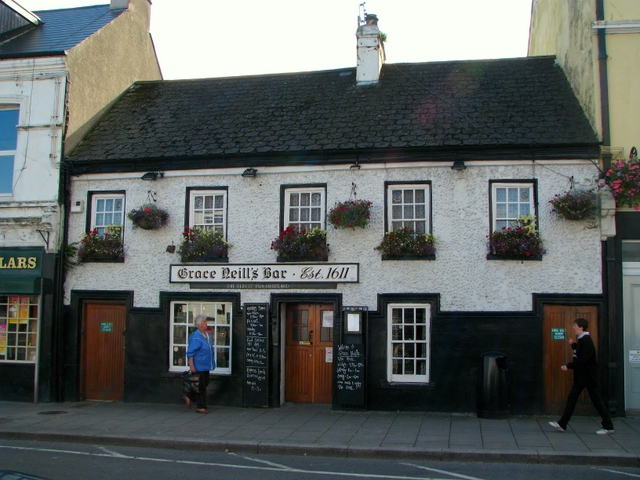
Where is `windows`? The width and height of the screenshot is (640, 480). windows is located at coordinates (402, 366), (408, 339), (411, 218), (511, 208), (305, 203), (207, 218), (108, 208), (4, 129), (3, 170).